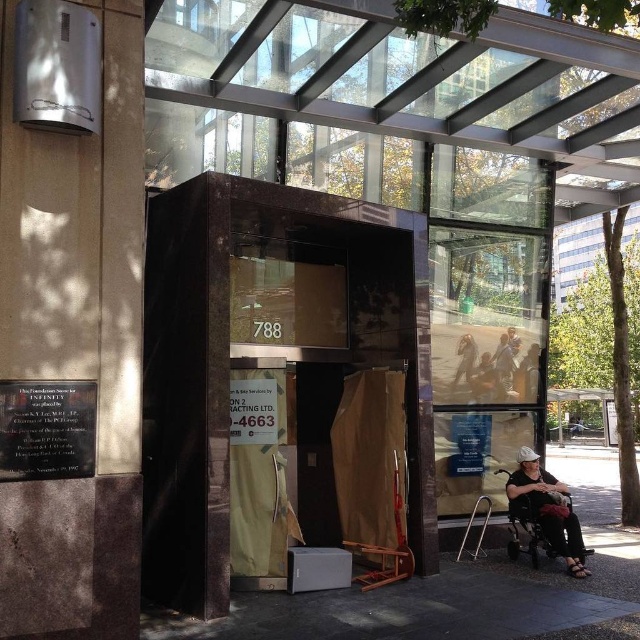
Question: Which point appears farthest from the camera in this image?

Choices:
 (A) (561, 547)
 (B) (468, 353)

Answer: (B)

Question: Is the position of black fabric wheelchair at lower right less distant than that of dark blue jeans at center?

Choices:
 (A) yes
 (B) no

Answer: (A)

Question: Which object is closer to the camera taking this photo?

Choices:
 (A) dark blue jeans at center
 (B) black fabric wheelchair at lower right

Answer: (B)

Question: Does black fabric wheelchair at lower right have a larger size compared to dark blue jeans at center?

Choices:
 (A) yes
 (B) no

Answer: (A)

Question: Can you confirm if black fabric wheelchair at lower right is bigger than dark blue jeans at center?

Choices:
 (A) yes
 (B) no

Answer: (A)

Question: Which point appears closest to the camera in this image?

Choices:
 (A) (573, 547)
 (B) (465, 364)

Answer: (A)